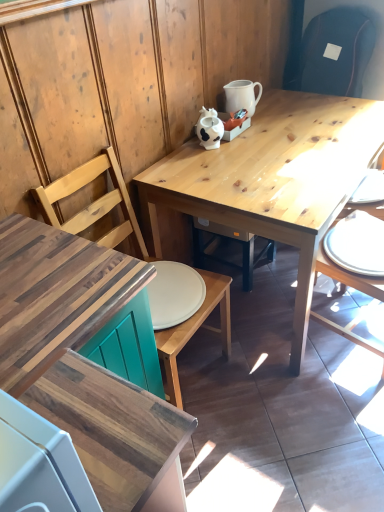
Question: Is point (96, 206) closer or farther from the camera than point (362, 234)?

Choices:
 (A) farther
 (B) closer

Answer: (B)

Question: Would you say wooden chair at center, acting as the 2th chair starting from the right, is to the left or to the right of white glossy plate at right in the picture?

Choices:
 (A) right
 (B) left

Answer: (B)

Question: Which of these objects is positioned closest to the wooden chair at right, which is the 2th chair in left-to-right order?

Choices:
 (A) white glossy pitcher at upper center
 (B) natural wood table at center
 (C) white glossy plate at right
 (D) wooden chair at center, the first chair viewed from the left
 (E) wooden desk at lower left

Answer: (C)

Question: Based on their relative distances, which object is farther from the wooden chair at center, acting as the 2th chair starting from the right?

Choices:
 (A) white matte cow-shaped teapot at upper center
 (B) white glossy pitcher at upper center
 (C) natural wood table at center
 (D) wooden chair at right, which is the 2th chair in left-to-right order
 (E) white glossy plate at right

Answer: (E)